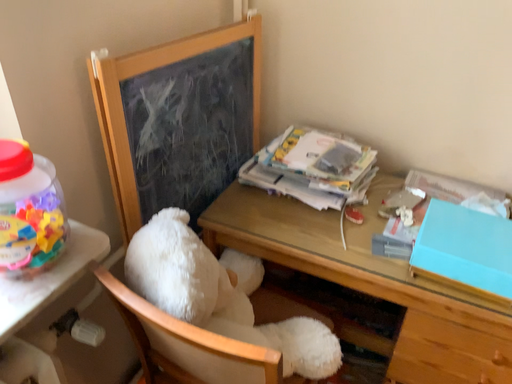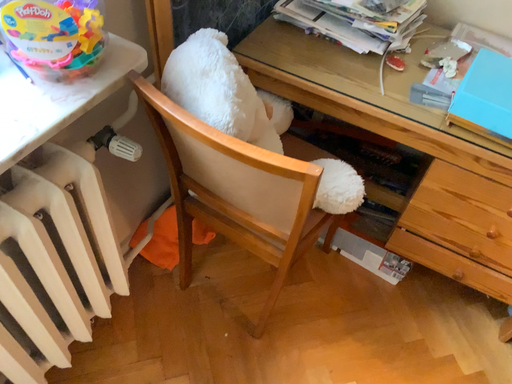
Question: Which way did the camera rotate in the video?

Choices:
 (A) rotated downward
 (B) rotated upward

Answer: (A)